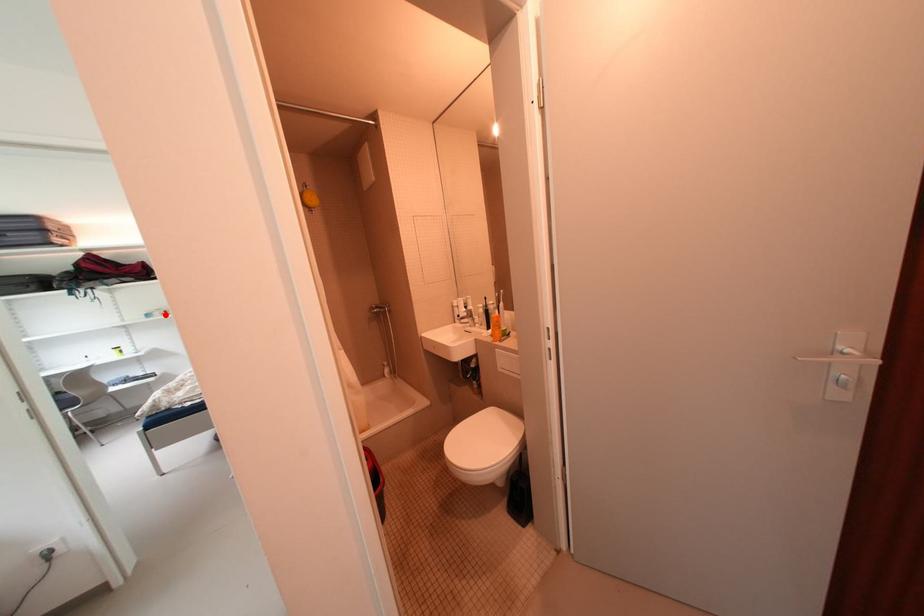
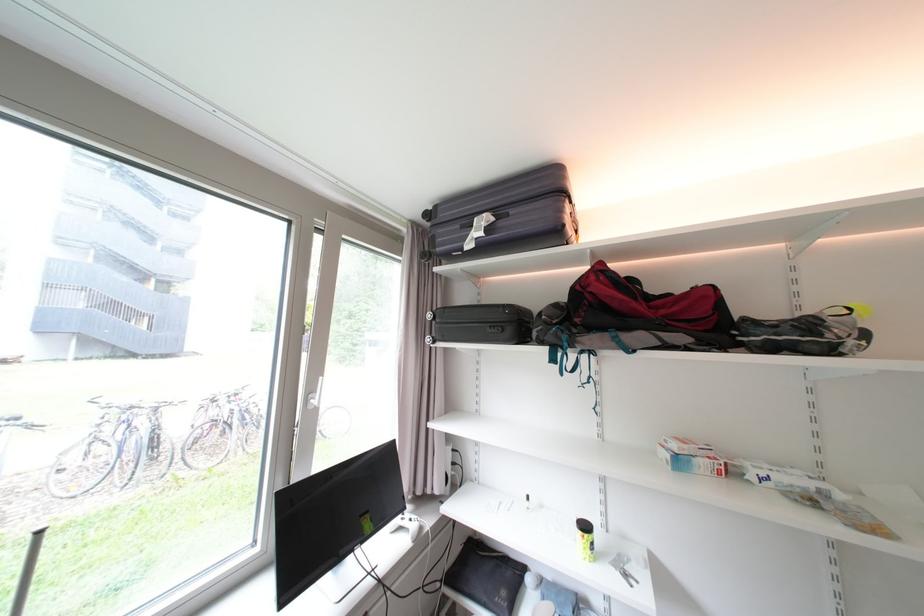
Find the pixel in the second image that matches the highlighted location in the first image.

(711, 464)